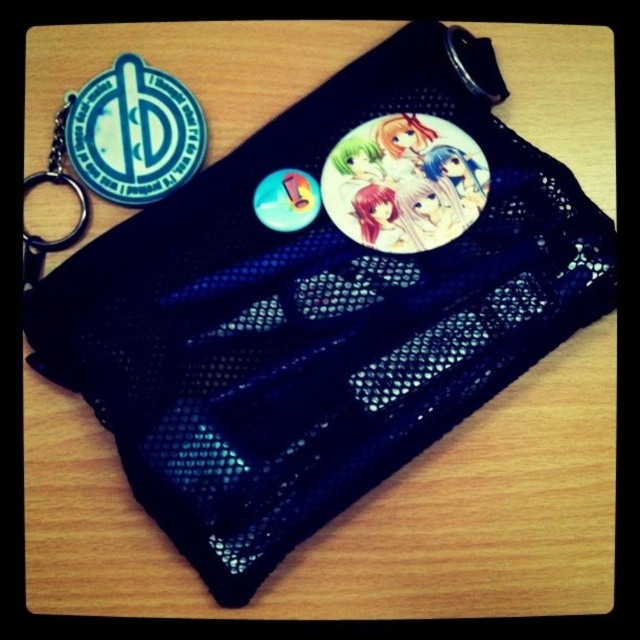
You are holding the black textured pouch and want to attach a keychain to the metal ring. Which badge, the blue rubber badge at upper left or the metallic silver badge at upper left, is easier to access when reaching from the front?

The blue rubber badge at upper left is closer to the viewer than the metallic silver badge at upper left, so it is easier to access when reaching from the front.

You are organizing a collection of badges on a display board. You have the blue rubber badge at upper left and the metallic silver badge at upper left. Which badge should you place first if you want to arrange them from largest to smallest?

The blue rubber badge at upper left is larger in size than the metallic silver badge at upper left, so you should place the blue rubber badge at upper left first when arranging from largest to smallest.